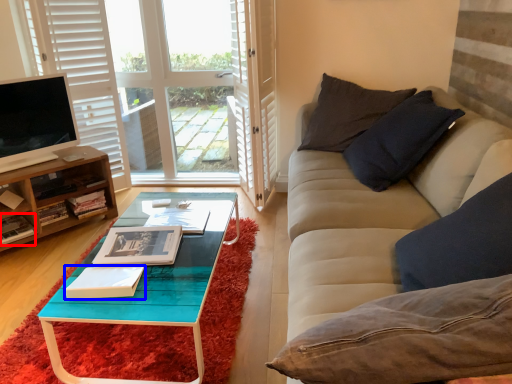
Question: Among these objects, which one is nearest to the camera, book (highlighted by a red box) or book (highlighted by a blue box)?

Choices:
 (A) book
 (B) book

Answer: (B)